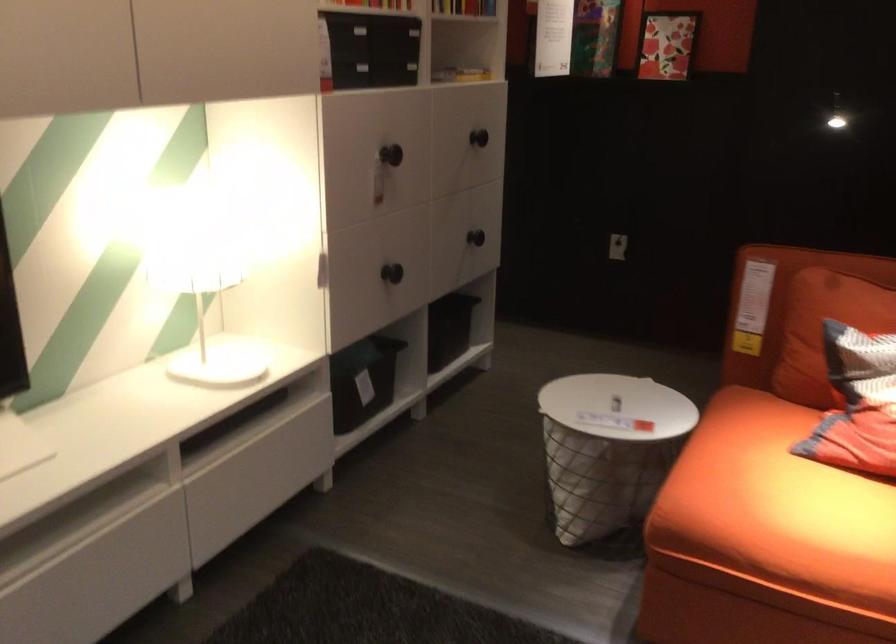
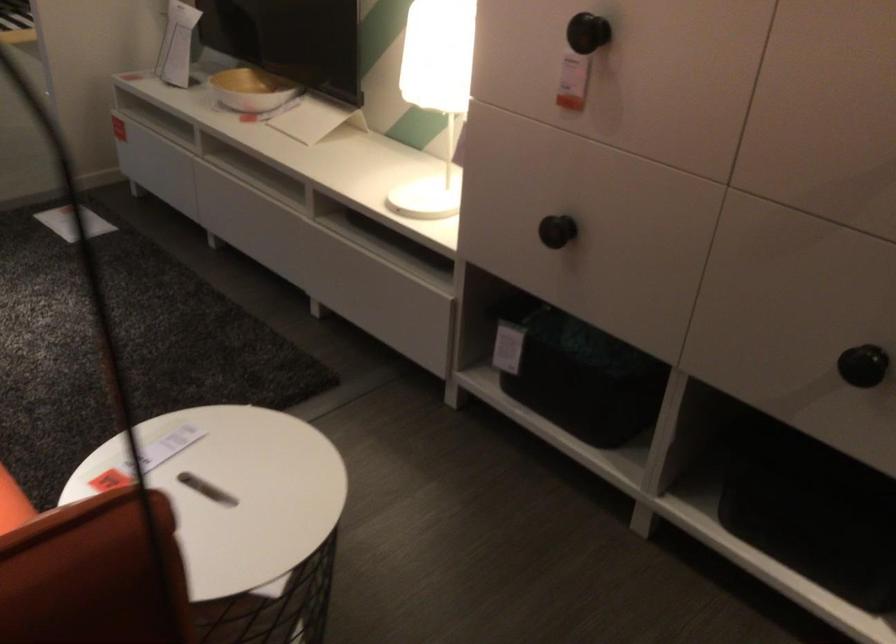
In the second image, find the point that corresponds to the point at 497,218 in the first image.

(863, 365)